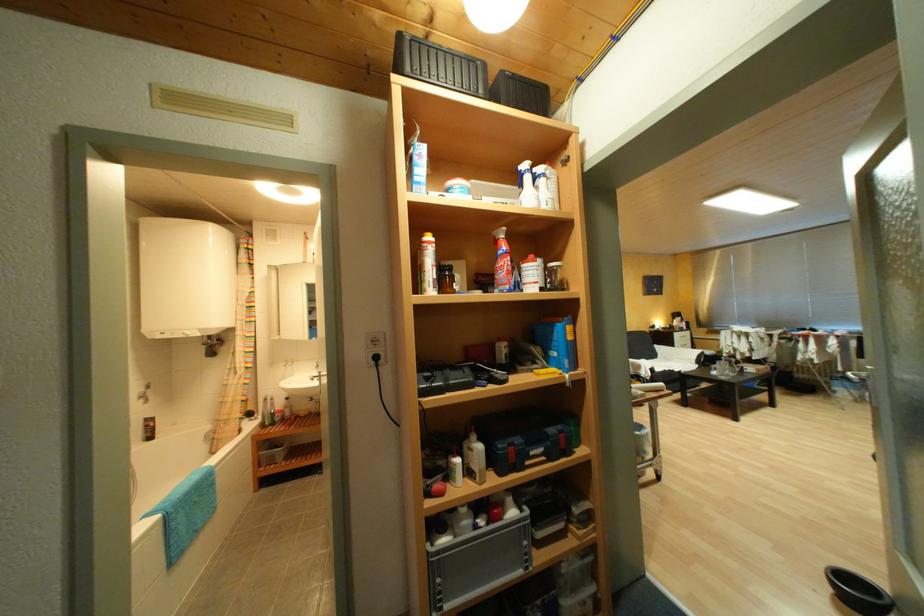
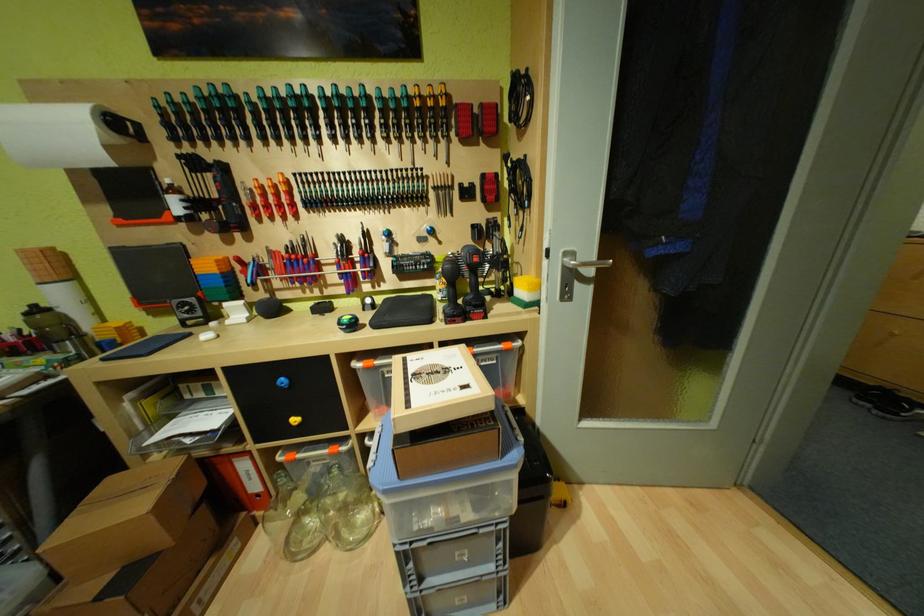
Question: I am providing you with two images of the same scene from different viewpoints. After the viewpoint changes to image2, which objects are now occluded?

Choices:
 (A) silver door handle
 (B) cordless drill handle
 (C) red striped pillow
 (D) sofa sitting surface

Answer: (D)